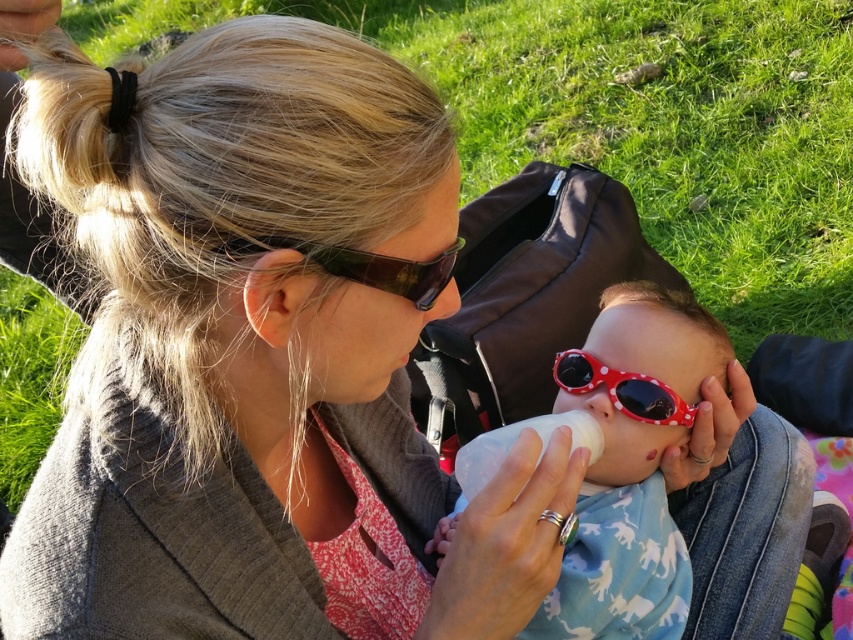
Question: Does black plastic goggles at upper center have a greater width compared to polka dot plastic goggles at center?

Choices:
 (A) no
 (B) yes

Answer: (B)

Question: Which object is positioned closest to the polka dot plastic sunglasses at center?

Choices:
 (A) black plastic goggles at upper center
 (B) polka dot plastic goggles at center

Answer: (B)

Question: Among these points, which one is farthest from the camera?

Choices:
 (A) (643, 385)
 (B) (692, 305)

Answer: (B)

Question: Is polka dot plastic sunglasses at center to the right of polka dot plastic goggles at center from the viewer's perspective?

Choices:
 (A) no
 (B) yes

Answer: (A)

Question: Which point is closer to the camera?

Choices:
 (A) polka dot plastic sunglasses at center
 (B) white plastic bottle at center

Answer: (B)

Question: Does polka dot plastic sunglasses at center have a larger size compared to polka dot plastic goggles at center?

Choices:
 (A) yes
 (B) no

Answer: (A)